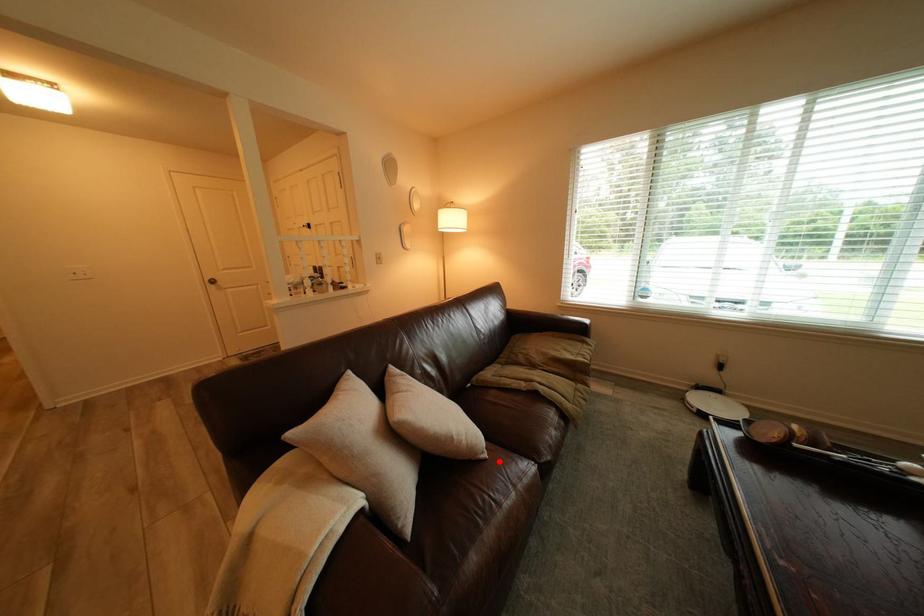
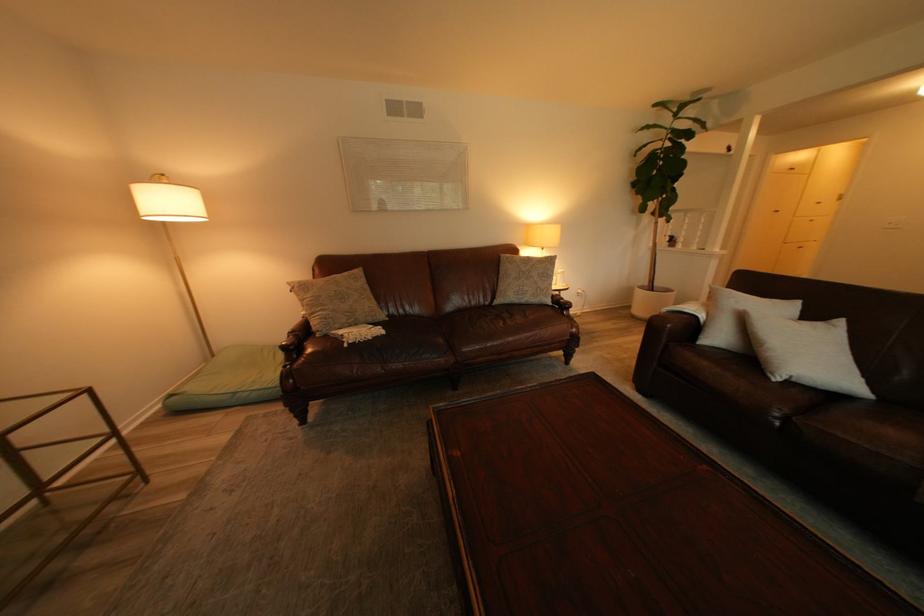
Locate, in the second image, the point that corresponds to the highlighted location in the first image.

(784, 379)